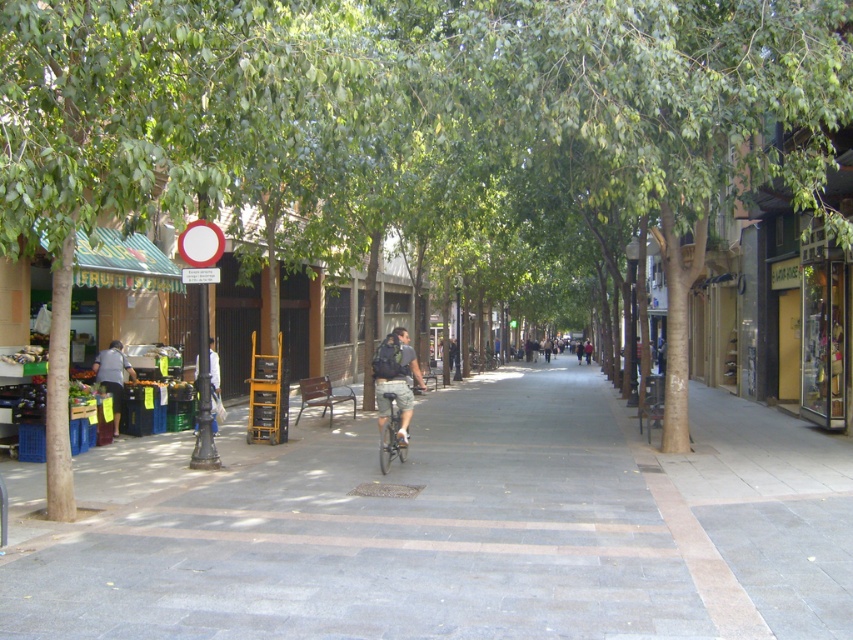
Question: Based on their relative distances, which object is nearer to the dark gray shirt at left?

Choices:
 (A) silver metallic bicycle at center
 (B) gray concrete sidewalk at center

Answer: (B)

Question: Which point is farther to the camera?

Choices:
 (A) dark gray backpack at center
 (B) gray concrete sidewalk at center

Answer: (A)

Question: Does gray concrete sidewalk at center come in front of dark gray backpack at center?

Choices:
 (A) yes
 (B) no

Answer: (A)

Question: Considering the relative positions of dark gray backpack at center and white fabric bag at center in the image provided, where is dark gray backpack at center located with respect to white fabric bag at center?

Choices:
 (A) below
 (B) above

Answer: (A)

Question: Is dark gray backpack at center to the left of white fabric bag at center from the viewer's perspective?

Choices:
 (A) no
 (B) yes

Answer: (A)

Question: Which of these objects is positioned closest to the silver metallic bicycle at center?

Choices:
 (A) dark gray shirt at left
 (B) dark gray backpack at center
 (C) gray concrete sidewalk at center

Answer: (B)